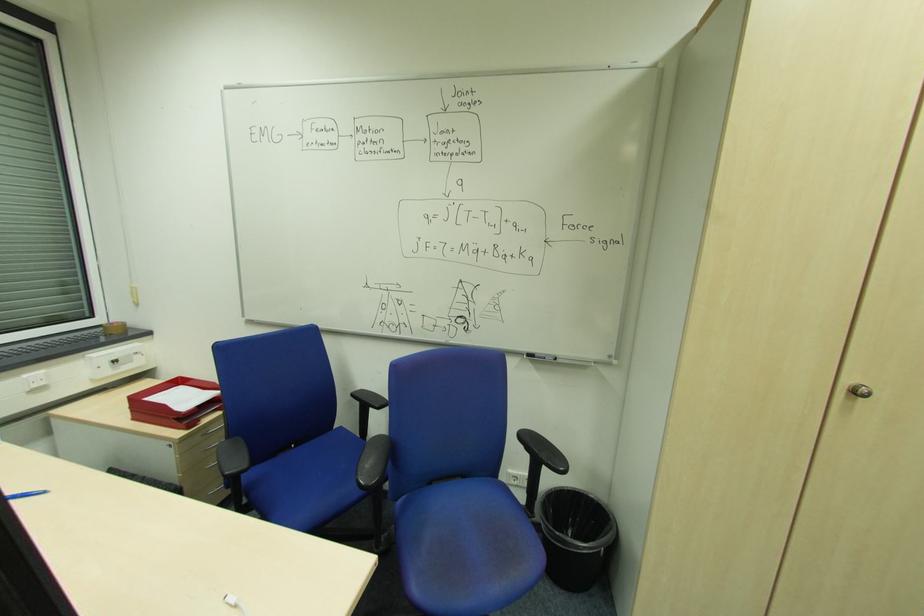
Image resolution: width=924 pixels, height=616 pixels. Identify the location of blue chair sitting surface. (466, 546).